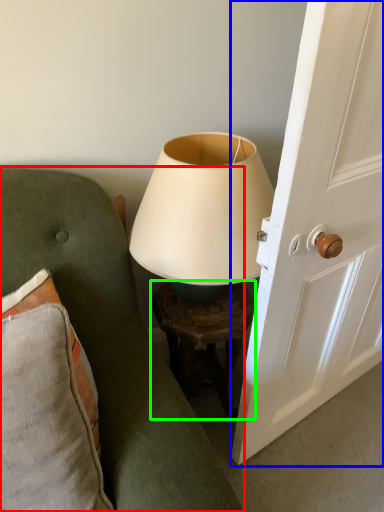
Question: Based on their relative distances, which object is nearer to furniture (highlighted by a red box)? Choose from screen door (highlighted by a blue box) and table (highlighted by a green box).

Choices:
 (A) screen door
 (B) table

Answer: (B)